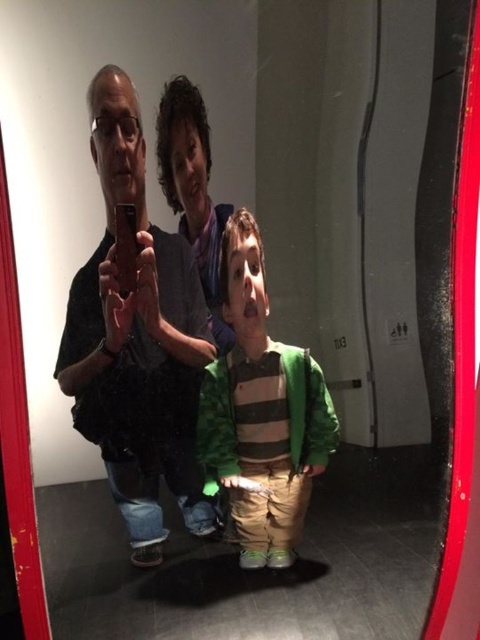
Question: Is matte black shirt at left thinner than green striped sweater at center?

Choices:
 (A) yes
 (B) no

Answer: (A)

Question: Does matte black shirt at left lie behind green striped sweater at center?

Choices:
 (A) no
 (B) yes

Answer: (A)

Question: Does matte black shirt at left have a smaller size compared to green striped sweater at center?

Choices:
 (A) no
 (B) yes

Answer: (A)

Question: Which point is farther to the camera?

Choices:
 (A) green striped sweater at center
 (B) matte black shirt at left

Answer: (A)